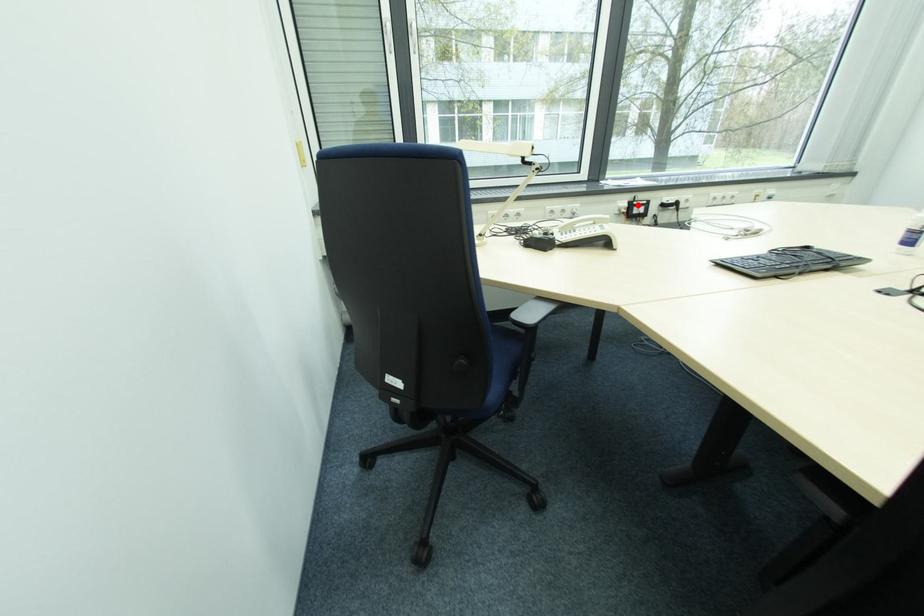
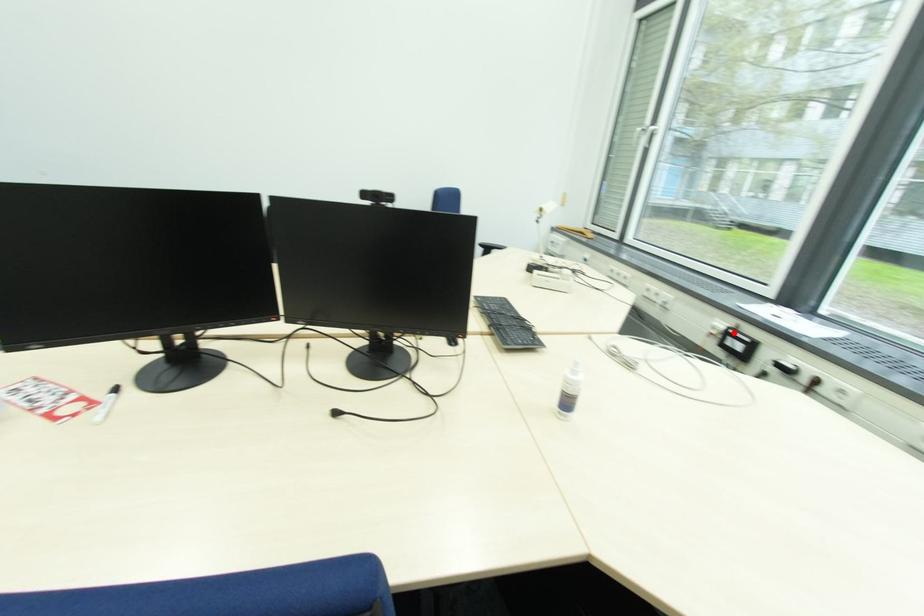
I am providing you with two images of the same scene from different viewpoints. A red point is marked on the first image and another point is marked on the second image. Is the marked point in image1 the same physical position as the marked point in image2?

Yes